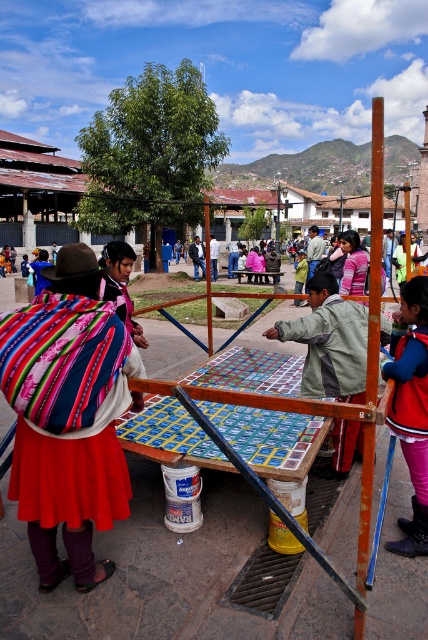
You need to place a rectangular box that is 1.2 meters wide on the table. The table has the multicolored woven fabric at center and the matte pink sweater at center. Which object should you move to make space for the box?

The multicolored woven fabric at center has a smaller width than the matte pink sweater at center. Therefore, moving the multicolored woven fabric at center would free up enough space for the 1.2 meters wide box since it takes up less area on the table.

You are a tourist standing in front of the wooden table in the square. You want to pick up the multicolored woven fabric at center and the velvet red coat at lower right. Which item do you need to reach further to get?

The velvet red coat at lower right requires reaching further because it is farther from the viewer compared to the multicolored woven fabric at center, which is closer.